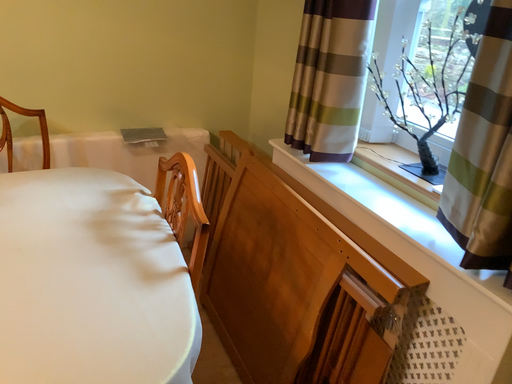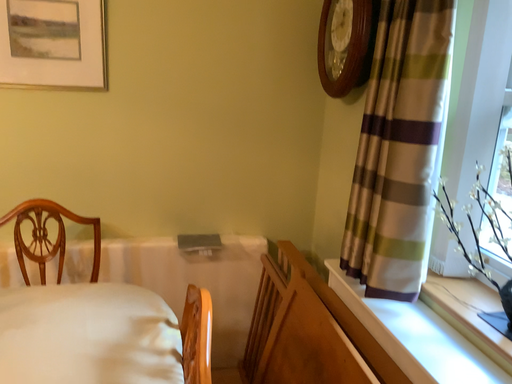
Question: How did the camera likely rotate when shooting the video?

Choices:
 (A) rotated left
 (B) rotated right

Answer: (A)